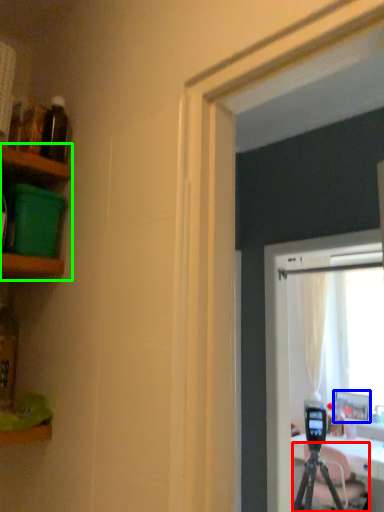
Question: Which is farther away from tripod (highlighted by a red box)? picture frame (highlighted by a blue box) or shelf (highlighted by a green box)?

Choices:
 (A) picture frame
 (B) shelf

Answer: (B)